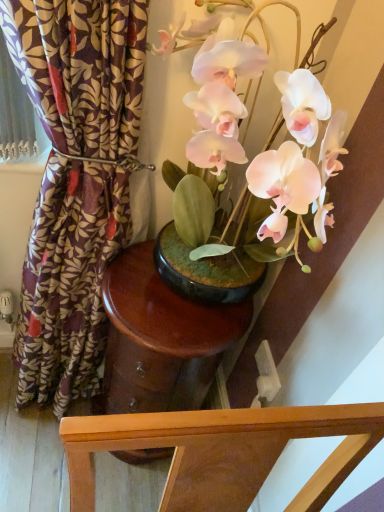
Where is `white plastic power outlet at lower right`? white plastic power outlet at lower right is located at coordinates (266, 373).

Find the location of a particular element. matte pink orchid at center is located at coordinates (241, 164).

What's the angular difference between white plastic power outlet at lower right and matte pink orchid at center's facing directions?

The angle between the facing direction of white plastic power outlet at lower right and the facing direction of matte pink orchid at center is 89.6 degrees.

From a real-world perspective, is white plastic power outlet at lower right located higher than matte pink orchid at center?

Actually, white plastic power outlet at lower right is physically below matte pink orchid at center in the real world.

Is point (269, 395) positioned after point (229, 224)?

That is True.

Which object is more forward, white plastic power outlet at lower right or matte pink orchid at center?

Positioned in front is matte pink orchid at center.

Is glossy wood side table at center situated inside white plastic power outlet at lower right or outside?

glossy wood side table at center is not inside white plastic power outlet at lower right, it's outside.

Relative to white plastic power outlet at lower right, is glossy wood side table at center in front or behind?

glossy wood side table at center is in front of white plastic power outlet at lower right.

Which object is positioned more to the right, glossy wood side table at center or white plastic power outlet at lower right?

white plastic power outlet at lower right.

Considering the points (111, 351) and (259, 354), which point is behind, point (111, 351) or point (259, 354)?

Positioned behind is point (259, 354).

Between point (242, 199) and point (266, 341), which one is positioned behind?

The point (266, 341) is farther.

From the image's perspective, is matte pink orchid at center above or below white plastic power outlet at lower right?

Based on their image positions, matte pink orchid at center is located above white plastic power outlet at lower right.

Considering the relative sizes of matte pink orchid at center and white plastic power outlet at lower right in the image provided, is matte pink orchid at center bigger than white plastic power outlet at lower right?

Yes.

Considering the positions of points (270, 376) and (120, 194), is point (270, 376) farther from camera compared to point (120, 194)?

Yes.

Identify the location of power outlet below the purple floral fabric at left (from a real-world perspective). This screenshot has width=384, height=512. (266, 373).

Based on the photo, from the image's perspective, which object appears higher, white plastic power outlet at lower right or purple floral fabric at left?

From the image's view, purple floral fabric at left is above.

Does white plastic power outlet at lower right have a greater width compared to purple floral fabric at left?

Incorrect, the width of white plastic power outlet at lower right does not surpass that of purple floral fabric at left.

Is matte pink orchid at center not inside purple floral fabric at left?

matte pink orchid at center is positioned outside purple floral fabric at left.

Which is in front, point (237, 99) or point (70, 104)?

The point (237, 99) is closer to the camera.

In terms of size, does matte pink orchid at center appear bigger or smaller than purple floral fabric at left?

Clearly, matte pink orchid at center is smaller in size than purple floral fabric at left.

Based on their positions, is purple floral fabric at left located to the left or right of matte pink orchid at center?

In the image, purple floral fabric at left appears on the left side of matte pink orchid at center.

Can matte pink orchid at center be found inside purple floral fabric at left?

No, matte pink orchid at center is not surrounded by purple floral fabric at left.

Is purple floral fabric at left next to matte pink orchid at center and touching it?

purple floral fabric at left and matte pink orchid at center are clearly separated.

Does purple floral fabric at left turn towards matte pink orchid at center?

No, purple floral fabric at left is not turned towards matte pink orchid at center.

From the image's perspective, relative to glossy wood side table at center, is matte pink orchid at center above or below?

Based on their image positions, matte pink orchid at center is located above glossy wood side table at center.

Which is behind, point (246, 176) or point (179, 371)?

The point (179, 371) is more distant.

Is matte pink orchid at center looking in the opposite direction of glossy wood side table at center?

No, matte pink orchid at center is not facing the opposite direction of glossy wood side table at center.

From a real-world perspective, is matte pink orchid at center physically located above or below glossy wood side table at center?

In terms of real-world spatial position, matte pink orchid at center is above glossy wood side table at center.

Identify the location of power outlet below the matte pink orchid at center (from a real-world perspective). The image size is (384, 512). (266, 373).

The image size is (384, 512). What are the coordinates of `round table that is in front of the white plastic power outlet at lower right` in the screenshot? It's located at (161, 338).

Considering their positions, is glossy wood side table at center positioned closer to matte pink orchid at center than white plastic power outlet at lower right?

glossy wood side table at center.

From the image, which object appears to be farther from matte pink orchid at center, white plastic power outlet at lower right or glossy wood side table at center?

Among the two, white plastic power outlet at lower right is located further to matte pink orchid at center.

Based on their spatial positions, is purple floral fabric at left or matte pink orchid at center further from white plastic power outlet at lower right?

Among the two, purple floral fabric at left is located further to white plastic power outlet at lower right.

Looking at this image, estimate the real-world distances between objects in this image. Which object is further from purple floral fabric at left, glossy wood side table at center or white plastic power outlet at lower right?

white plastic power outlet at lower right is positioned further to the anchor purple floral fabric at left.

When comparing their distances from purple floral fabric at left, does matte pink orchid at center or glossy wood side table at center seem further?

The object further to purple floral fabric at left is matte pink orchid at center.

Considering their positions, is purple floral fabric at left positioned closer to glossy wood side table at center than matte pink orchid at center?

The object closer to glossy wood side table at center is purple floral fabric at left.

Considering their positions, is glossy wood side table at center positioned closer to white plastic power outlet at lower right than matte pink orchid at center?

Based on the image, glossy wood side table at center appears to be nearer to white plastic power outlet at lower right.

Based on their spatial positions, is purple floral fabric at left or glossy wood side table at center further from matte pink orchid at center?

purple floral fabric at left is further to matte pink orchid at center.

What are the coordinates of `round table positioned between matte pink orchid at center and white plastic power outlet at lower right from near to far` in the screenshot? It's located at (161, 338).

Find the location of a particular element. The image size is (384, 512). round table between purple floral fabric at left and white plastic power outlet at lower right from front to back is located at coordinates (161, 338).

Identify the location of curtain located between matte pink orchid at center and glossy wood side table at center in the depth direction. This screenshot has width=384, height=512. (68, 281).

The image size is (384, 512). Identify the location of curtain between matte pink orchid at center and white plastic power outlet at lower right in the front-back direction. (68, 281).